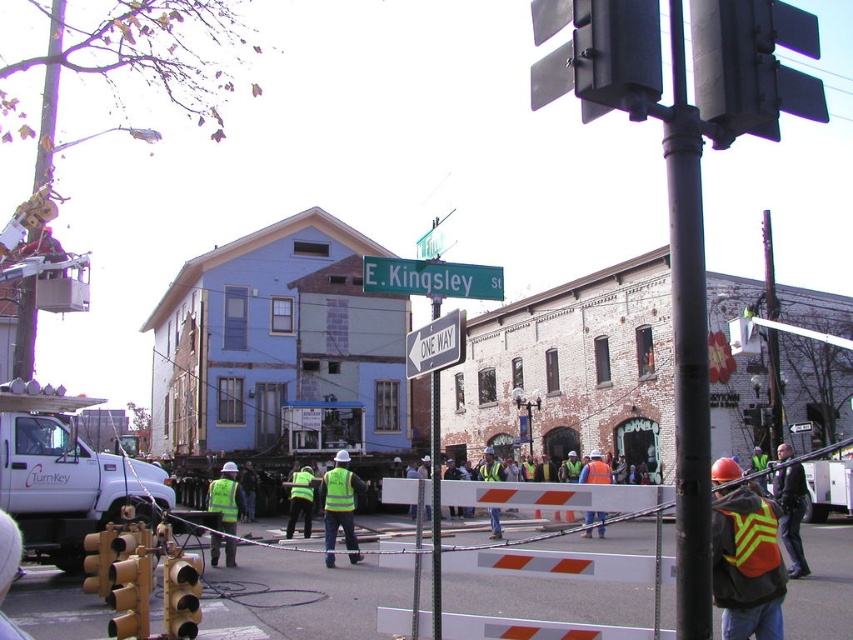
You are a delivery driver approaching the construction site. Your truck is 12 feet wide. The point at coordinates (756,54) marks the edge of the construction zone. Can your truck safely pass through the construction zone without going beyond this point?

The point at coordinates (756,54) is 19.26 feet away from the camera. Since your truck is 12 feet wide, there is enough space between the edge of the construction zone and the camera to safely pass through without exceeding the 19.26 feet distance. Therefore, the truck can pass safely.